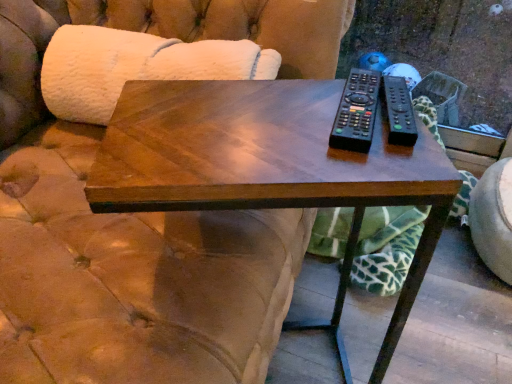
At what (x,y) coordinates should I click in order to perform the action: click on free spot to the left of black plastic remote at right, the first remote viewed from the right. Please return your answer as a coordinate pair (x, y). This screenshot has width=512, height=384. Looking at the image, I should click on (271, 121).